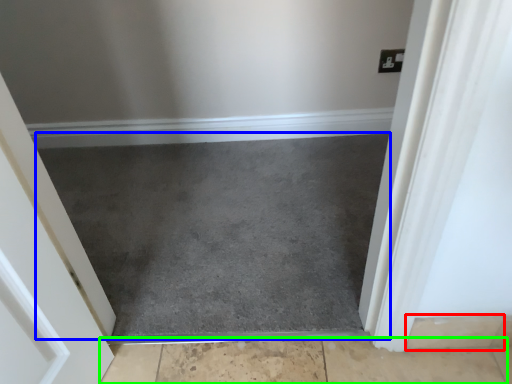
Question: Which object is positioned farthest from concrete (highlighted by a red box)? Select from slate (highlighted by a blue box) and concrete (highlighted by a green box).

Choices:
 (A) slate
 (B) concrete

Answer: (A)